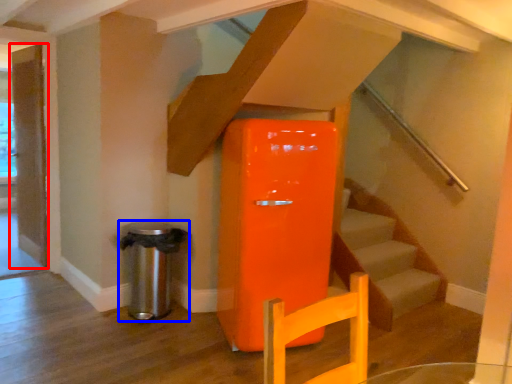
Question: Which object appears closest to the camera in this image, door (highlighted by a red box) or water heater (highlighted by a blue box)?

Choices:
 (A) door
 (B) water heater

Answer: (B)